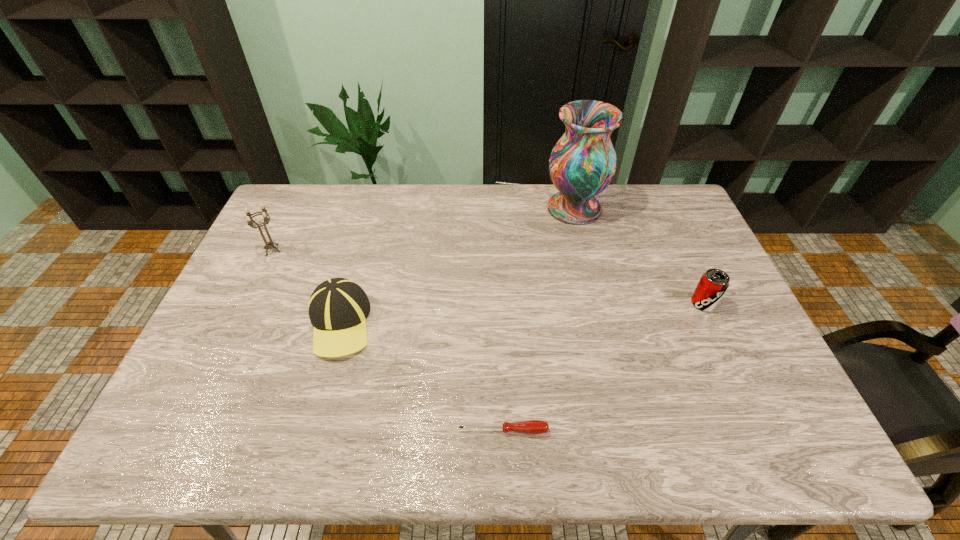
Locate an element on the screen. This screenshot has width=960, height=540. vacant region between the screwdriver and the baseball cap is located at coordinates (421, 377).

Locate an element on the screen. The image size is (960, 540). free point between the shortest object and the farthest object is located at coordinates (539, 319).

Find the location of `free point between the screwdriver and the baseball cap`. free point between the screwdriver and the baseball cap is located at coordinates (421, 377).

Locate which object ranks fourth in proximity to the soda can. Please provide its 2D coordinates. Your answer should be formatted as a tuple, i.e. [(x, y)], where the tuple contains the x and y coordinates of a point satisfying the conditions above.

[(250, 221)]

Locate which object ranks in proximity to the fourth object from right to left. Please provide its 2D coordinates. Your answer should be formatted as a tuple, i.e. [(x, y)], where the tuple contains the x and y coordinates of a point satisfying the conditions above.

[(250, 221)]

You are a GUI agent. You are given a task and a screenshot of the screen. Output one action in this format:
    pyautogui.click(x=<x>, y=<y>)
    Task: Click on the free spot that satisfies the following two spatial constraints: 1. on the back side of the fourth object from left to right; 2. on the left side of the leftmost object
    
    Given the screenshot: What is the action you would take?
    pyautogui.click(x=292, y=208)

You are a GUI agent. You are given a task and a screenshot of the screen. Output one action in this format:
    pyautogui.click(x=<x>, y=<y>)
    Task: Click on the free space in the image that satisfies the following two spatial constraints: 1. on the back side of the screwdriver; 2. on the right side of the rightmost object
    This screenshot has height=540, width=960.
    Given the screenshot: What is the action you would take?
    pyautogui.click(x=498, y=303)

Where is `vacant space that satisfies the following two spatial constraints: 1. on the back side of the soda can; 2. on the left side of the screwdriver`? vacant space that satisfies the following two spatial constraints: 1. on the back side of the soda can; 2. on the left side of the screwdriver is located at coordinates (498, 303).

At what (x,y) coordinates should I click in order to perform the action: click on vacant area in the image that satisfies the following two spatial constraints: 1. on the back side of the vase; 2. on the left side of the candle holder. Please return your answer as a coordinate pair (x, y). This screenshot has width=960, height=540. Looking at the image, I should click on (292, 208).

At what (x,y) coordinates should I click in order to perform the action: click on vacant space that satisfies the following two spatial constraints: 1. with the brim of the nearest object facing forward; 2. on the right side of the baseball cap. Please return your answer as a coordinate pair (x, y). This screenshot has height=540, width=960. Looking at the image, I should click on (310, 430).